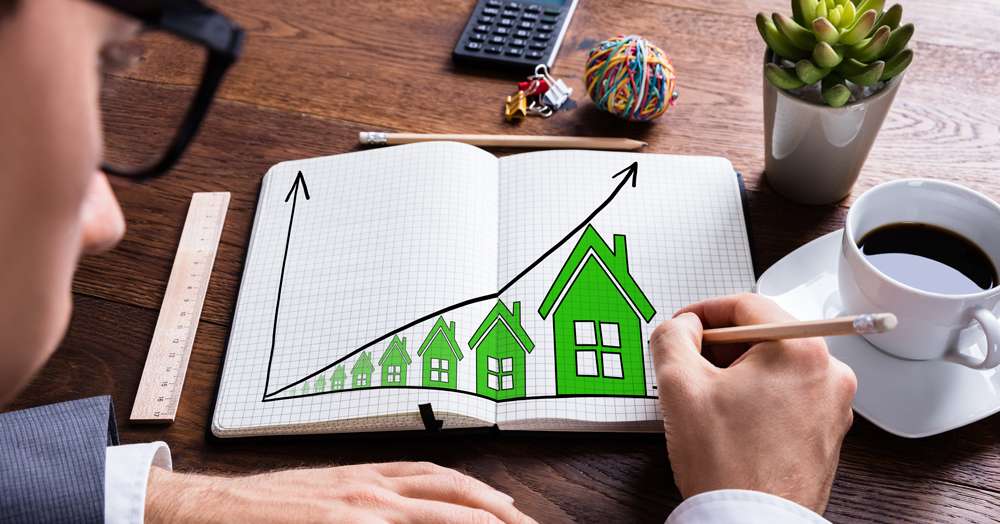
The height and width of the screenshot is (524, 1000). I want to click on cup, so click(920, 325).